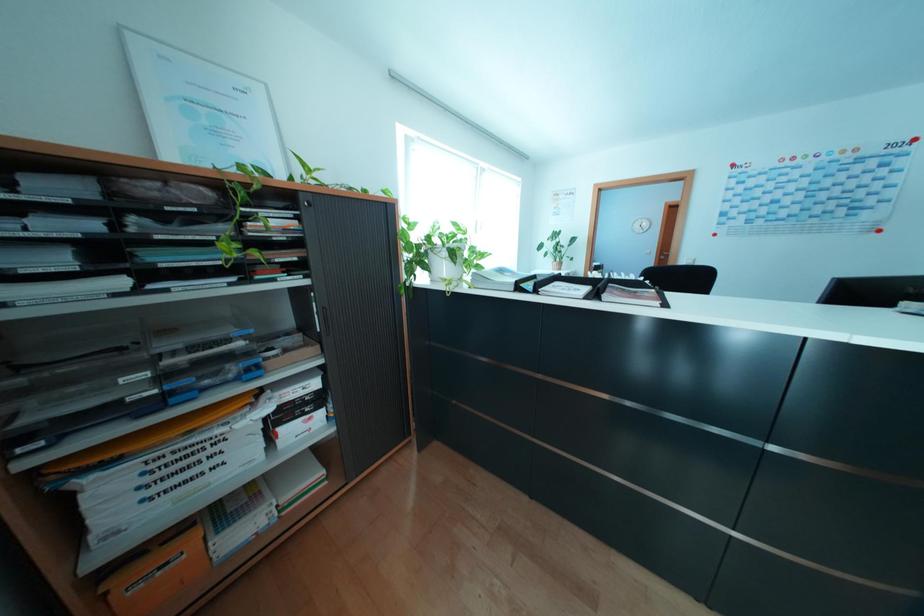
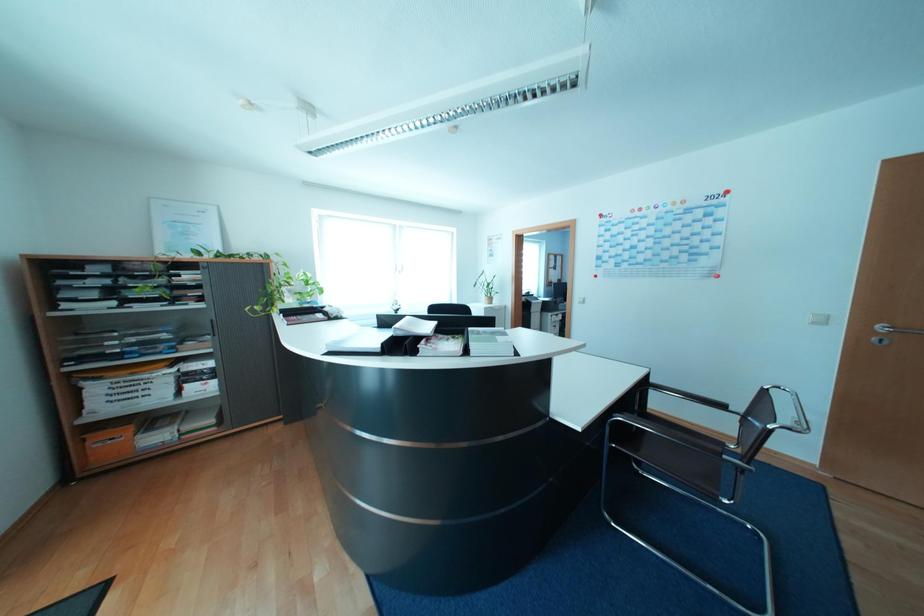
Question: The images are taken continuously from a first-person perspective. In which direction are you moving?

Choices:
 (A) Left
 (B) Right
 (C) Forward
 (D) Backward

Answer: (B)